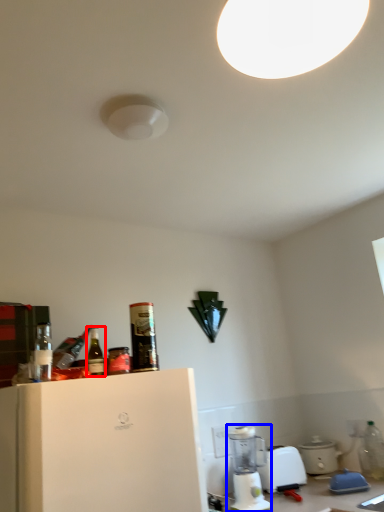
Question: Among these objects, which one is nearest to the camera, bottle (highlighted by a red box) or blender (highlighted by a blue box)?

Choices:
 (A) bottle
 (B) blender

Answer: (A)